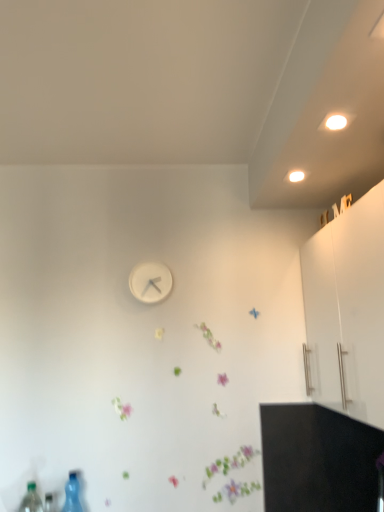
What do you see at coordinates (230, 463) in the screenshot? The width and height of the screenshot is (384, 512). I see `purple matte flower at center` at bounding box center [230, 463].

This screenshot has height=512, width=384. What do you see at coordinates (150, 282) in the screenshot?
I see `white matte clock at center` at bounding box center [150, 282].

This screenshot has height=512, width=384. What do you see at coordinates (72, 494) in the screenshot? I see `transparent plastic bottle at lower left, which appears as the first bottle when viewed from the right` at bounding box center [72, 494].

What do you see at coordinates (31, 500) in the screenshot?
I see `transparent plastic bottle at lower left, marked as the 2th bottle in a right-to-left arrangement` at bounding box center [31, 500].

How much space does transparent plastic bottle at lower left, the 2th bottle positioned from the back, occupy horizontally?

transparent plastic bottle at lower left, the 2th bottle positioned from the back, is 3.24 inches wide.

At what (x,y) coordinates should I click in order to perform the action: click on purple matte flower at center. Please return your answer as a coordinate pair (x, y). Image resolution: width=384 pixels, height=512 pixels. Looking at the image, I should click on (230, 463).

The image size is (384, 512). Find the location of `the 2nd bottle in front of the purple matte flower at center`. the 2nd bottle in front of the purple matte flower at center is located at coordinates (31, 500).

Are purple matte flower at center and transparent plastic bottle at lower left, which ranks as the 1th bottle in front-to-back order, located far from each other?

No.

Looking at this image, between purple matte flower at center and transparent plastic bottle at lower left, the 2th bottle positioned from the back, which one appears on the right side from the viewer's perspective?

purple matte flower at center is more to the right.

Considering the positions of point (226, 495) and point (38, 504), is point (226, 495) closer or farther from the camera than point (38, 504)?

Clearly, point (226, 495) is more distant from the camera than point (38, 504).

Considering the sizes of objects white matte cabinet at upper right and purple matte flower at center in the image provided, who is taller, white matte cabinet at upper right or purple matte flower at center?

white matte cabinet at upper right is taller.

Considering the positions of objects white matte cabinet at upper right and purple matte flower at center in the image provided, who is behind, white matte cabinet at upper right or purple matte flower at center?

purple matte flower at center is more distant.

Is white matte cabinet at upper right to the left of purple matte flower at center from the viewer's perspective?

No.

Which of these two, purple matte flower at center or white matte clock at center, stands taller?

white matte clock at center.

How distant is purple matte flower at center from white matte clock at center?

purple matte flower at center is 31.89 inches from white matte clock at center.

Locate an element on the screen. The height and width of the screenshot is (512, 384). wall clock that appears on the left of purple matte flower at center is located at coordinates (150, 282).

Based on the photo, is purple matte flower at center aimed at white matte clock at center?

No, purple matte flower at center is not turned towards white matte clock at center.

Locate an element on the screen. The width and height of the screenshot is (384, 512). flower below the white matte clock at center (from the image's perspective) is located at coordinates (230, 463).

How many degrees apart are the facing directions of white matte clock at center and purple matte flower at center?

2.24 degrees separate the facing orientations of white matte clock at center and purple matte flower at center.

How much distance is there between white matte clock at center and purple matte flower at center?

The distance of white matte clock at center from purple matte flower at center is 31.89 inches.

Which of these two, white matte clock at center or purple matte flower at center, is smaller?

purple matte flower at center is smaller.

Is transparent plastic bottle at lower left, which ranks as the 1th bottle in front-to-back order, in contact with purple matte flower at center?

There is a gap between transparent plastic bottle at lower left, which ranks as the 1th bottle in front-to-back order, and purple matte flower at center.

From a real-world perspective, does transparent plastic bottle at lower left, the 2th bottle positioned from the back, sit lower than purple matte flower at center?

Indeed, from a real-world perspective, transparent plastic bottle at lower left, the 2th bottle positioned from the back, is positioned beneath purple matte flower at center.

Is transparent plastic bottle at lower left, the 2th bottle positioned from the back, positioned with its back to purple matte flower at center?

transparent plastic bottle at lower left, the 2th bottle positioned from the back, is not turned away from purple matte flower at center.

From the image's perspective, is transparent plastic bottle at lower left, the 1th bottle in the left-to-right sequence, located above purple matte flower at center?

Actually, transparent plastic bottle at lower left, the 1th bottle in the left-to-right sequence, appears below purple matte flower at center in the image.

Can you confirm if transparent plastic bottle at lower left, the 2th bottle positioned from the back, is positioned to the right of transparent plastic bottle at lower left, the second bottle viewed from the front?

In fact, transparent plastic bottle at lower left, the 2th bottle positioned from the back, is to the left of transparent plastic bottle at lower left, the second bottle viewed from the front.

Could you tell me if transparent plastic bottle at lower left, the 1th bottle in the left-to-right sequence, is turned towards transparent plastic bottle at lower left, the second bottle viewed from the front?

No.

Is transparent plastic bottle at lower left, the 1th bottle in the left-to-right sequence, closer to the viewer compared to transparent plastic bottle at lower left, the second bottle viewed from the front?

Yes, transparent plastic bottle at lower left, the 1th bottle in the left-to-right sequence, is closer to the viewer.

Considering the points (34, 508) and (76, 474), which point is behind, point (34, 508) or point (76, 474)?

The point (76, 474) is behind.

Between transparent plastic bottle at lower left, marked as the 2th bottle in a right-to-left arrangement, and white matte cabinet at upper right, which one appears on the right side from the viewer's perspective?

white matte cabinet at upper right is more to the right.

Which is in front, point (36, 494) or point (358, 414)?

The point (358, 414) is more forward.

From the image's perspective, is transparent plastic bottle at lower left, the 2th bottle positioned from the back, under white matte cabinet at upper right?

Yes, from the image's perspective, transparent plastic bottle at lower left, the 2th bottle positioned from the back, is below white matte cabinet at upper right.

Between transparent plastic bottle at lower left, the 2th bottle positioned from the back, and white matte cabinet at upper right, which one is positioned in front?

white matte cabinet at upper right is more forward.

From a real-world perspective, which bottle is the 2nd one underneath the purple matte flower at center? Please provide its 2D coordinates.

[(31, 500)]

At what (x,y) coordinates should I click in order to perform the action: click on dresser that is above the purple matte flower at center (from the image's perspective). Please return your answer as a coordinate pair (x, y). Looking at the image, I should click on (x=348, y=307).

From the image, which object appears to be farther from purple matte flower at center, transparent plastic bottle at lower left, marked as the 2th bottle in a right-to-left arrangement, or white matte clock at center?

Based on the image, white matte clock at center appears to be further to purple matte flower at center.

From the image, which object appears to be farther from white matte cabinet at upper right, white matte clock at center or transparent plastic bottle at lower left, which is counted as the 1th bottle, starting from the back?

transparent plastic bottle at lower left, which is counted as the 1th bottle, starting from the back.

Looking at the image, which one is located closer to white matte clock at center, transparent plastic bottle at lower left, which ranks as the 1th bottle in front-to-back order, or purple matte flower at center?

purple matte flower at center lies closer to white matte clock at center than the other object.

Estimate the real-world distances between objects in this image. Which object is further from transparent plastic bottle at lower left, marked as the 2th bottle in a right-to-left arrangement, purple matte flower at center or white matte clock at center?

white matte clock at center is positioned further to the anchor transparent plastic bottle at lower left, marked as the 2th bottle in a right-to-left arrangement.

Looking at the image, which one is located further to transparent plastic bottle at lower left, which ranks as the 1th bottle in front-to-back order, white matte clock at center or transparent plastic bottle at lower left, the second bottle viewed from the front?

Based on the image, white matte clock at center appears to be further to transparent plastic bottle at lower left, which ranks as the 1th bottle in front-to-back order.

When comparing their distances from purple matte flower at center, does white matte cabinet at upper right or transparent plastic bottle at lower left, the second bottle viewed from the front, seem further?

white matte cabinet at upper right.

When comparing their distances from transparent plastic bottle at lower left, which appears as the first bottle when viewed from the right, does white matte clock at center or transparent plastic bottle at lower left, marked as the 2th bottle in a right-to-left arrangement, seem further?

white matte clock at center.

Looking at the image, which one is located further to white matte clock at center, white matte cabinet at upper right or transparent plastic bottle at lower left, which ranks as the 1th bottle in front-to-back order?

transparent plastic bottle at lower left, which ranks as the 1th bottle in front-to-back order, is further to white matte clock at center.

Where is `bottle between transparent plastic bottle at lower left, the 2th bottle positioned from the back, and purple matte flower at center from left to right`? This screenshot has height=512, width=384. bottle between transparent plastic bottle at lower left, the 2th bottle positioned from the back, and purple matte flower at center from left to right is located at coordinates [72, 494].

Image resolution: width=384 pixels, height=512 pixels. I want to click on wall clock situated between transparent plastic bottle at lower left, the second bottle viewed from the front, and white matte cabinet at upper right from left to right, so click(150, 282).

Image resolution: width=384 pixels, height=512 pixels. I want to click on flower between white matte clock at center and transparent plastic bottle at lower left, the 2th bottle viewed from the left, in the up-down direction, so click(x=230, y=463).

Where is `flower between transparent plastic bottle at lower left, the 2th bottle viewed from the left, and white matte cabinet at upper right`? Image resolution: width=384 pixels, height=512 pixels. flower between transparent plastic bottle at lower left, the 2th bottle viewed from the left, and white matte cabinet at upper right is located at coordinates (230, 463).